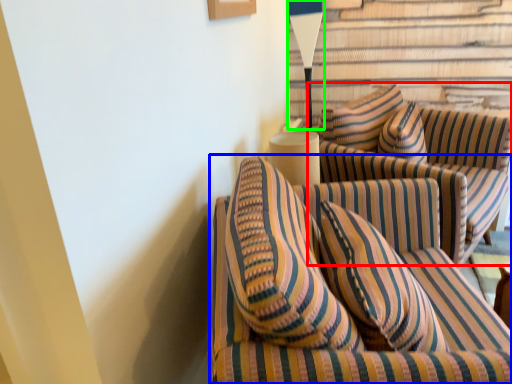
Question: Based on their relative distances, which object is farther from studio couch (highlighted by a red box)? Choose from studio couch (highlighted by a blue box) and table lamp (highlighted by a green box).

Choices:
 (A) studio couch
 (B) table lamp

Answer: (B)